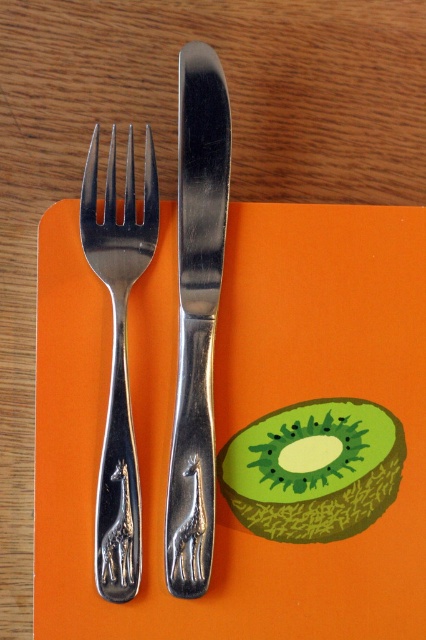
Between green matte kiwi at center and polished silver fork at left, which one appears on the left side from the viewer's perspective?

polished silver fork at left is more to the left.

Does green matte kiwi at center have a lesser width compared to polished silver fork at left?

No.

Does point (305, 451) come farther from viewer compared to point (100, 275)?

No, it is in front of (100, 275).

Locate an element on the screen. The image size is (426, 640). green matte kiwi at center is located at coordinates (313, 468).

Who is higher up, polished metal knife at center or polished silver fork at left?

polished metal knife at center

Who is more distant from viewer, (207,252) or (138,557)?

Point (207,252)

The width and height of the screenshot is (426, 640). I want to click on polished metal knife at center, so click(196, 316).

You are a GUI agent. You are given a task and a screenshot of the screen. Output one action in this format:
    pyautogui.click(x=<x>, y=<y>)
    Task: Click on the polished metal knife at center
    The image size is (426, 640).
    Given the screenshot: What is the action you would take?
    pyautogui.click(x=196, y=316)

Is polished metal knife at center shorter than green matte kiwi at center?

No.

Is polished metal knife at center to the left of green matte kiwi at center from the viewer's perspective?

Yes, polished metal knife at center is to the left of green matte kiwi at center.

Who is more forward, (222, 240) or (397, 461)?

Point (397, 461)

Image resolution: width=426 pixels, height=640 pixels. Find the location of `polished metal knife at center`. polished metal knife at center is located at coordinates (196, 316).